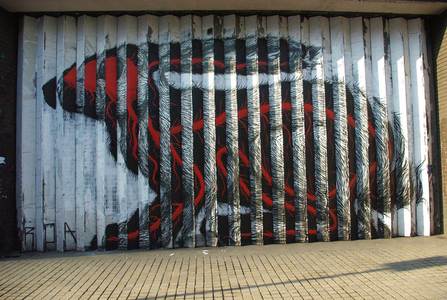
Locate an element on the screen. brown wall is located at coordinates (440, 78).